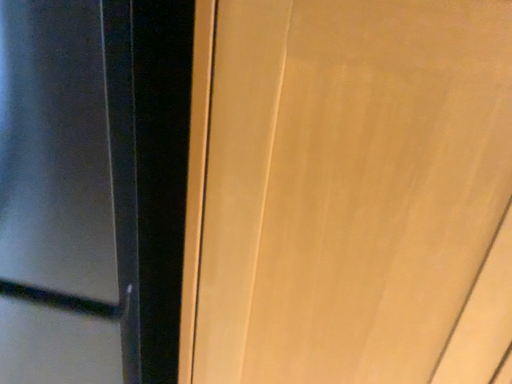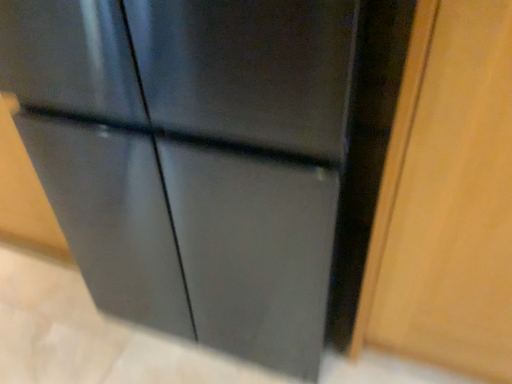
Question: How did the camera likely rotate when shooting the video?

Choices:
 (A) rotated downward
 (B) rotated upward

Answer: (A)